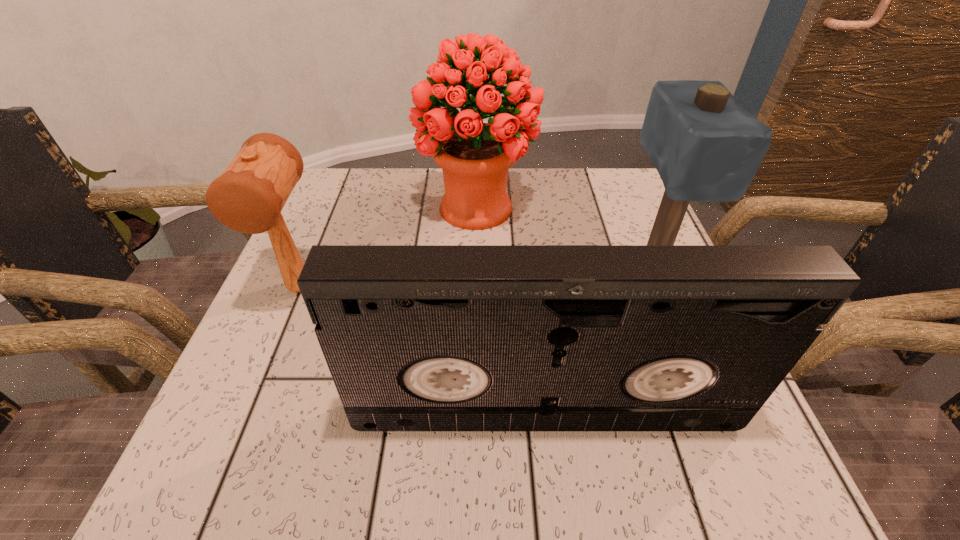
Where is `free space between the bouquet and the right mallet`? This screenshot has height=540, width=960. free space between the bouquet and the right mallet is located at coordinates (564, 238).

This screenshot has height=540, width=960. Find the location of `the closest object to the shorter mallet`. the closest object to the shorter mallet is located at coordinates (475, 157).

I want to click on the second closest object to the taller mallet, so click(x=416, y=337).